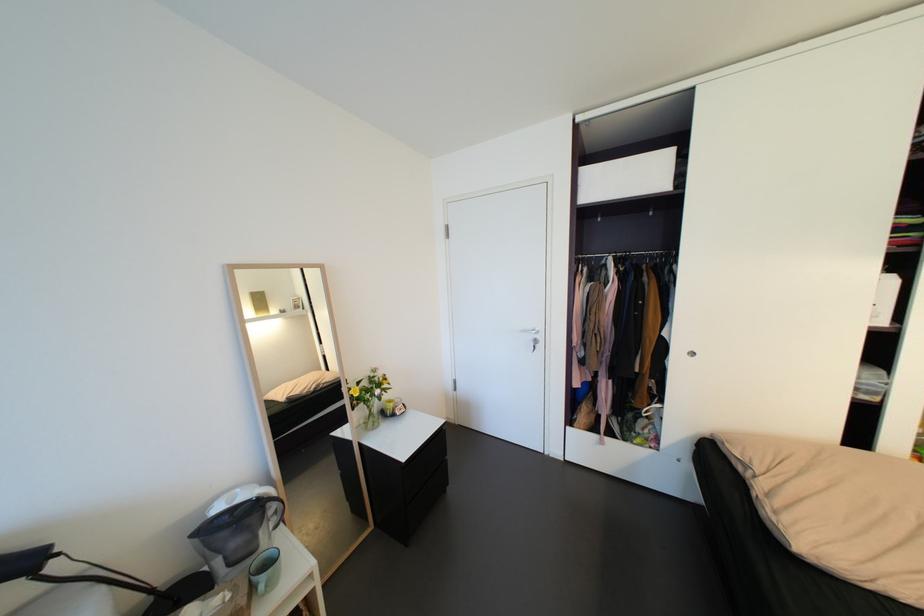
What do you see at coordinates (406, 485) in the screenshot? I see `a black drawer` at bounding box center [406, 485].